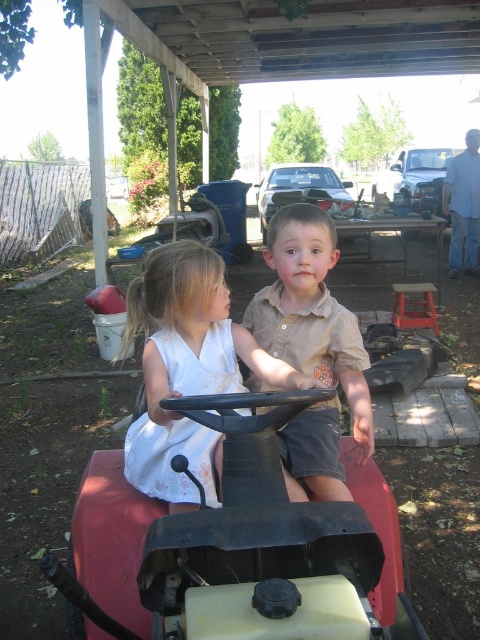
Question: Which object is farther from the camera taking this photo?

Choices:
 (A) metallic silver truck at upper right
 (B) matte plastic toy car at center
 (C) metallic silver toy car at center

Answer: (A)

Question: Which object is closer to the camera taking this photo?

Choices:
 (A) white matte dress at center
 (B) brown cotton shirt at center

Answer: (A)

Question: Which of the following is the farthest from the observer?

Choices:
 (A) brown cotton shirt at center
 (B) metallic silver toy car at center

Answer: (B)

Question: Does matte plastic toy car at center appear over metallic silver toy car at center?

Choices:
 (A) yes
 (B) no

Answer: (B)

Question: Observing the image, what is the correct spatial positioning of white matte dress at center in reference to brown cotton shirt at center?

Choices:
 (A) right
 (B) left

Answer: (B)

Question: Can you confirm if matte plastic toy car at center is positioned above brown cotton shirt at center?

Choices:
 (A) yes
 (B) no

Answer: (B)